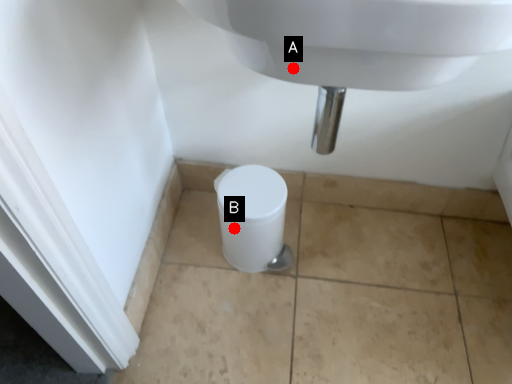
Question: Two points are circled on the image, labeled by A and B beside each circle. Among these points, which one is farthest from the camera?

Choices:
 (A) A is further
 (B) B is further

Answer: (B)